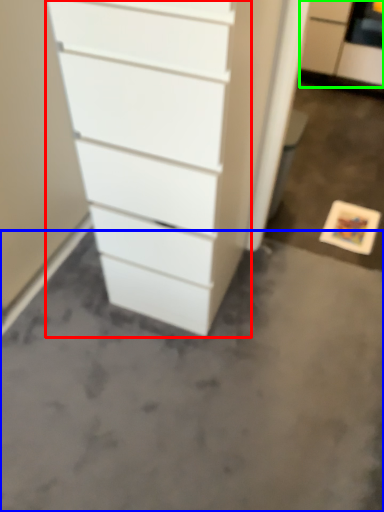
Question: Based on their relative distances, which object is nearer to chest of drawers (highlighted by a red box)? Choose from concrete (highlighted by a blue box) and filing cabinet (highlighted by a green box).

Choices:
 (A) concrete
 (B) filing cabinet

Answer: (A)